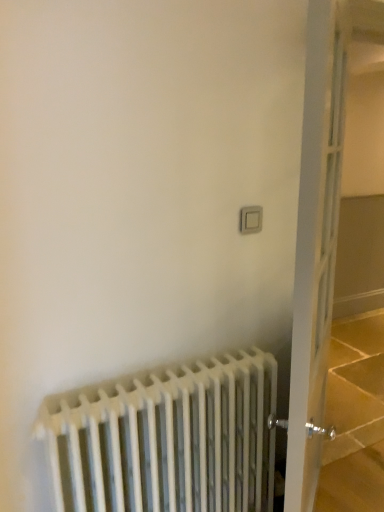
This screenshot has width=384, height=512. What do you see at coordinates (167, 438) in the screenshot? I see `white metal radiator at lower left` at bounding box center [167, 438].

What is the approximate width of white glass door at right?

4.20 inches.

The image size is (384, 512). Describe the element at coordinates (251, 219) in the screenshot. I see `white plastic switch at upper right` at that location.

Where is `white metal radiator at lower left`? white metal radiator at lower left is located at coordinates (167, 438).

Between white plastic switch at upper right and white metal radiator at lower left, which one has larger width?

Wider between the two is white metal radiator at lower left.

Identify the location of electric outlet above the white metal radiator at lower left (from a real-world perspective). (251, 219).

From the image's perspective, who appears lower, white plastic switch at upper right or white metal radiator at lower left?

white metal radiator at lower left, from the image's perspective.

Based on their positions, is white plastic switch at upper right located to the left or right of white metal radiator at lower left?

white plastic switch at upper right is positioned on white metal radiator at lower left's right side.

From the image's perspective, does white glass door at right appear higher than white metal radiator at lower left?

Indeed, from the image's perspective, white glass door at right is shown above white metal radiator at lower left.

From a real-world perspective, is white glass door at right beneath white metal radiator at lower left?

Incorrect, from a real-world perspective, white glass door at right is higher than white metal radiator at lower left.

Considering the relative sizes of white glass door at right and white metal radiator at lower left in the image provided, is white glass door at right taller than white metal radiator at lower left?

Yes, white glass door at right is taller than white metal radiator at lower left.

Between white metal radiator at lower left and white glass door at right, which one is positioned in front?

white glass door at right is closer to the camera.

In terms of size, does white metal radiator at lower left appear bigger or smaller than white glass door at right?

In the image, white metal radiator at lower left appears to be smaller than white glass door at right.

Between white metal radiator at lower left and white glass door at right, which one appears on the left side from the viewer's perspective?

From the viewer's perspective, white metal radiator at lower left appears more on the left side.

Is white metal radiator at lower left far away from white glass door at right?

No.

Is white metal radiator at lower left not close to white plastic switch at upper right?

white metal radiator at lower left is actually quite close to white plastic switch at upper right.

From a real-world perspective, is white metal radiator at lower left under white plastic switch at upper right?

Correct, in the physical world, white metal radiator at lower left is lower than white plastic switch at upper right.

From the image's perspective, who appears lower, white metal radiator at lower left or white plastic switch at upper right?

white metal radiator at lower left is shown below in the image.

Does white metal radiator at lower left appear on the left side of white plastic switch at upper right?

Yes.

Identify the location of door that is in front of the white plastic switch at upper right. The width and height of the screenshot is (384, 512). (315, 245).

From the image's perspective, relative to white glass door at right, is white plastic switch at upper right above or below?

Clearly, from the image's perspective, white plastic switch at upper right is above white glass door at right.

Is white plastic switch at upper right inside or outside of white glass door at right?

The correct answer is: outside.

Find the location of a particular element. electric outlet that appears above the white glass door at right (from a real-world perspective) is located at coordinates (251, 219).

Between white glass door at right and white plastic switch at upper right, which one has larger width?

white glass door at right.

Considering the sizes of objects white glass door at right and white plastic switch at upper right in the image provided, who is taller, white glass door at right or white plastic switch at upper right?

With more height is white glass door at right.

From the image's perspective, which one is positioned higher, white glass door at right or white plastic switch at upper right?

white plastic switch at upper right appears higher in the image.

Identify the location of radiator that is under the white plastic switch at upper right (from a real-world perspective). The height and width of the screenshot is (512, 384). (167, 438).

At what (x,y) coordinates should I click in order to perform the action: click on radiator below the white glass door at right (from the image's perspective). Please return your answer as a coordinate pair (x, y). Looking at the image, I should click on [167, 438].

Based on their spatial positions, is white plastic switch at upper right or white metal radiator at lower left further from white glass door at right?

The object further to white glass door at right is white plastic switch at upper right.

Looking at the image, which one is located closer to white metal radiator at lower left, white plastic switch at upper right or white glass door at right?

white glass door at right lies closer to white metal radiator at lower left than the other object.

In the scene shown: Which object lies nearer to the anchor point white metal radiator at lower left, white glass door at right or white plastic switch at upper right?

Based on the image, white glass door at right appears to be nearer to white metal radiator at lower left.

From the image, which object appears to be farther from white plastic switch at upper right, white glass door at right or white metal radiator at lower left?

Based on the image, white metal radiator at lower left appears to be further to white plastic switch at upper right.

Looking at the image, which one is located closer to white glass door at right, white metal radiator at lower left or white plastic switch at upper right?

Among the two, white metal radiator at lower left is located nearer to white glass door at right.

When comparing their distances from white plastic switch at upper right, does white metal radiator at lower left or white glass door at right seem closer?

white glass door at right is closer to white plastic switch at upper right.

The image size is (384, 512). What are the coordinates of `door that lies between white plastic switch at upper right and white metal radiator at lower left from top to bottom` in the screenshot? It's located at click(315, 245).